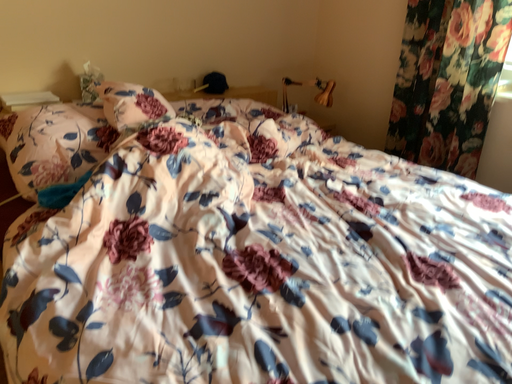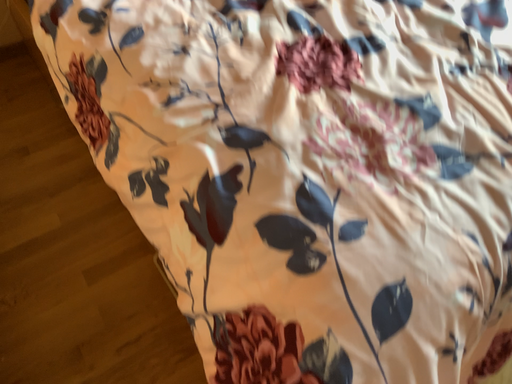
Question: How did the camera likely rotate when shooting the video?

Choices:
 (A) rotated downward
 (B) rotated upward

Answer: (A)